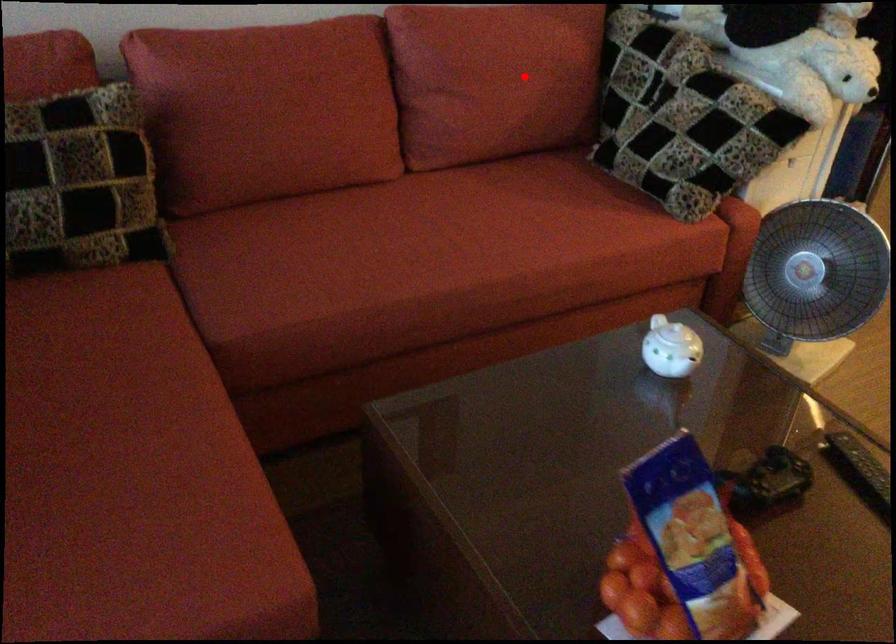
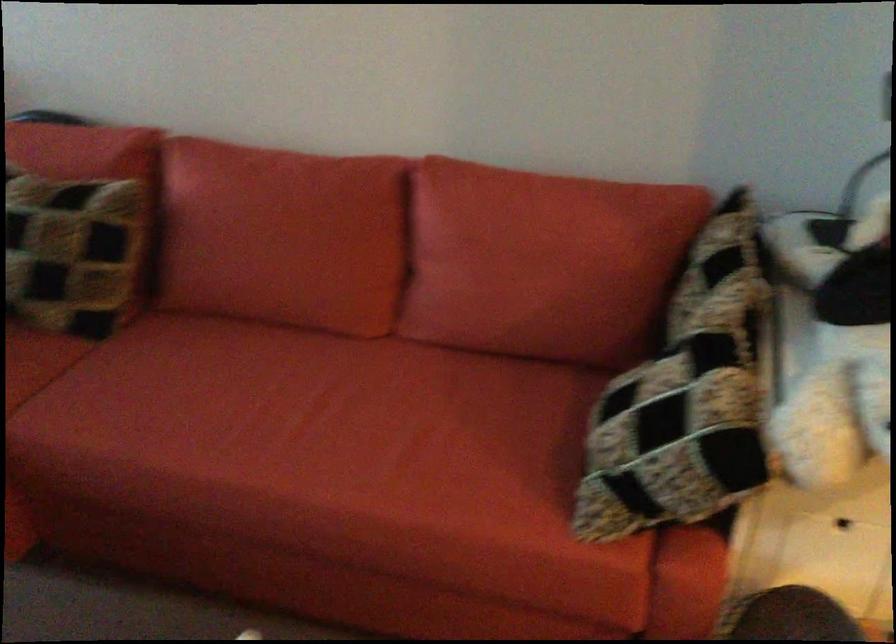
Question: I am providing you with two images of the same scene from different viewpoints. Image1 has a red point marked. In image2, the corresponding 3D location appears at what relative position? Reply with the corresponding letter.

Choices:
 (A) Closer
 (B) Farther

Answer: (A)